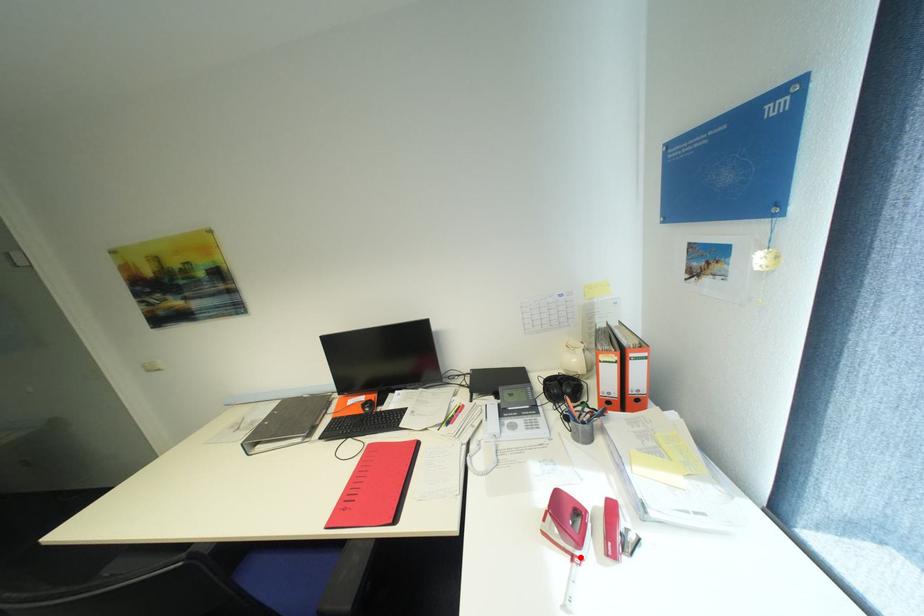
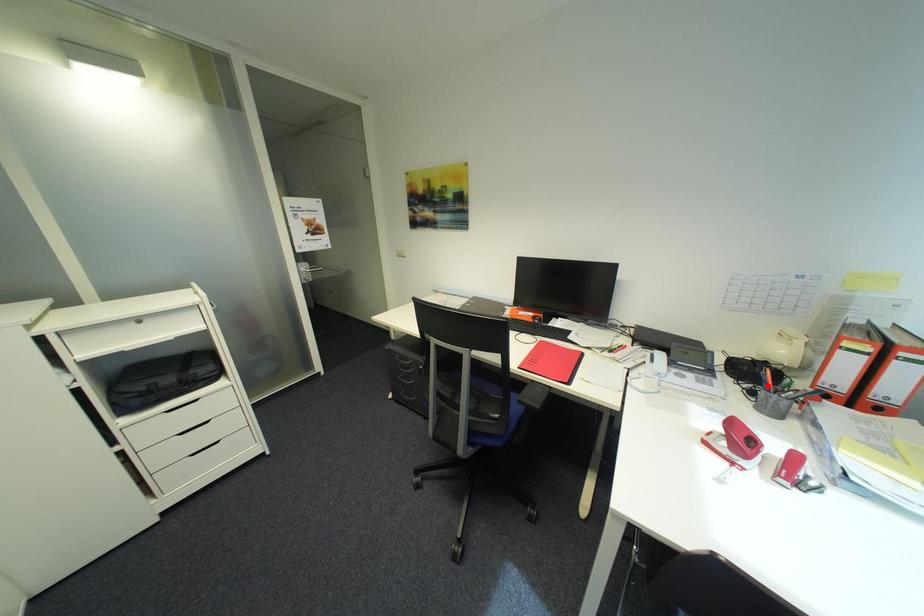
I am providing you with two images of the same scene from different viewpoints. A red point is marked on the first image and another point is marked on the second image. Is the red point in image1 aligned with the point shown in image2?

No